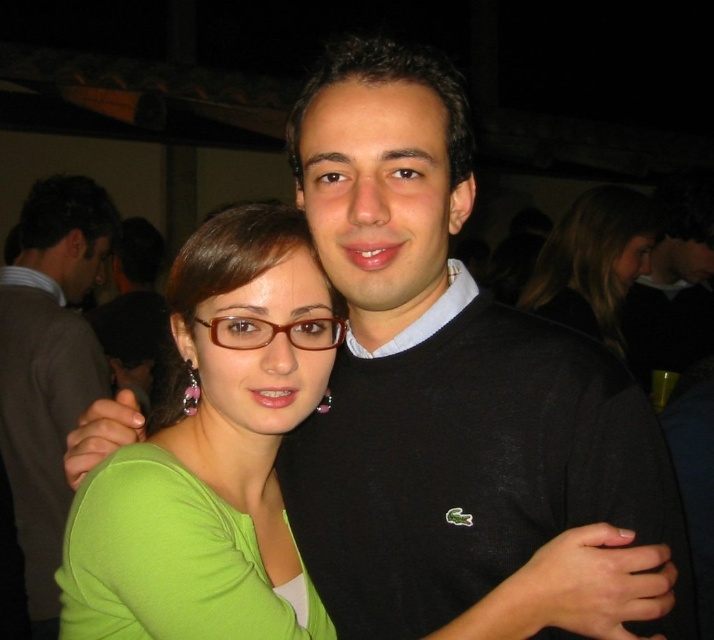
Is point (129, 256) positioned in front of point (236, 333)?

No, (129, 256) is behind (236, 333).

Who is more forward, (131, 381) or (306, 324)?

Point (306, 324)

Where is `matte black sweater at center`? The height and width of the screenshot is (640, 714). matte black sweater at center is located at coordinates (131, 307).

Is green matte shirt at center in front of matte black sweater at center?

Yes, green matte shirt at center is in front of matte black sweater at center.

Is point (111, 499) closer to camera compared to point (130, 280)?

Yes, it is.

Between point (248, 304) and point (149, 365), which one is positioned behind?

The point (149, 365) is behind.

At what (x,y) coordinates should I click in order to perform the action: click on green matte shirt at center. Please return your answer as a coordinate pair (x, y). Looking at the image, I should click on (211, 451).

Describe the element at coordinates (673, 282) in the screenshot. I see `black matte sweater at center` at that location.

Can you confirm if black matte sweater at center is thinner than matte black sweater at center?

In fact, black matte sweater at center might be wider than matte black sweater at center.

Find the location of a particular element. This screenshot has width=714, height=640. black matte sweater at center is located at coordinates (673, 282).